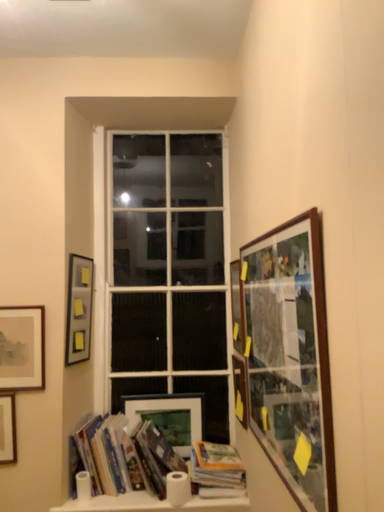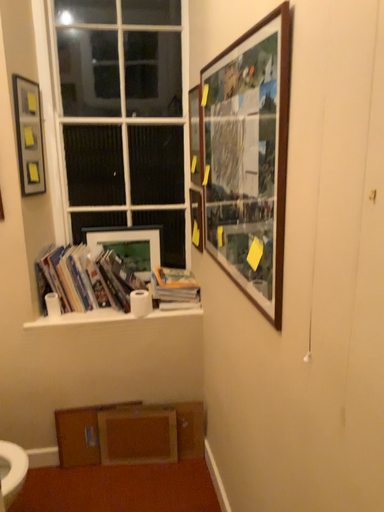
Question: How did the camera likely rotate when shooting the video?

Choices:
 (A) rotated downward
 (B) rotated upward

Answer: (A)